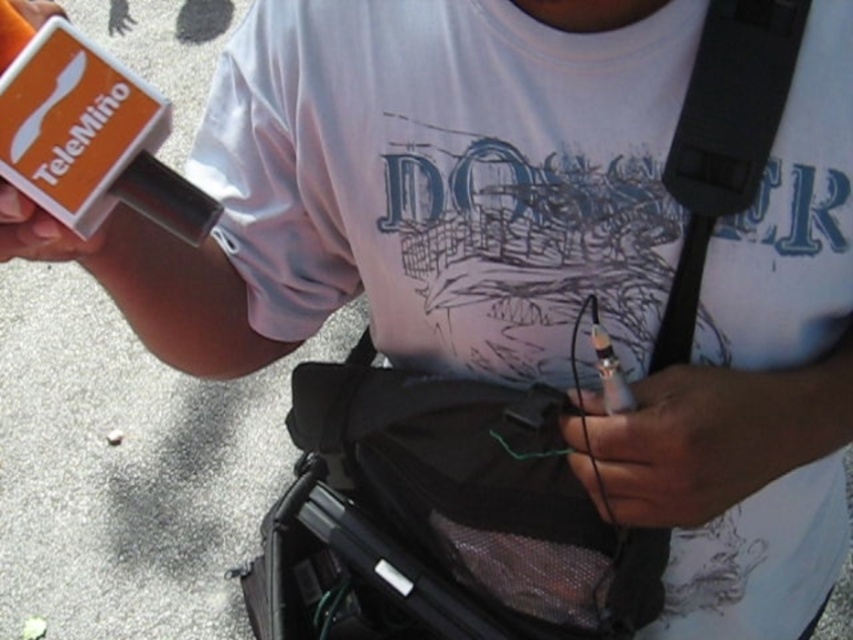
Is point (601, 426) positioned behind point (784, 35)?

Yes.

Locate an element on the screen. Image resolution: width=853 pixels, height=640 pixels. black matte pen at lower center is located at coordinates (689, 442).

Image resolution: width=853 pixels, height=640 pixels. I want to click on black matte pen at lower center, so click(689, 442).

Is white matte t-shirt at center above black matte strap at upper right?

Yes.

Which is more to the right, white matte t-shirt at center or black matte strap at upper right?

black matte strap at upper right

Where is `white matte t-shirt at center`? This screenshot has height=640, width=853. white matte t-shirt at center is located at coordinates (450, 176).

Between point (296, 141) and point (662, 460), which one is positioned behind?

Positioned behind is point (296, 141).

Who is positioned more to the left, white matte t-shirt at center or black matte pen at lower center?

Positioned to the left is white matte t-shirt at center.

Locate an element on the screen. white matte t-shirt at center is located at coordinates (450, 176).